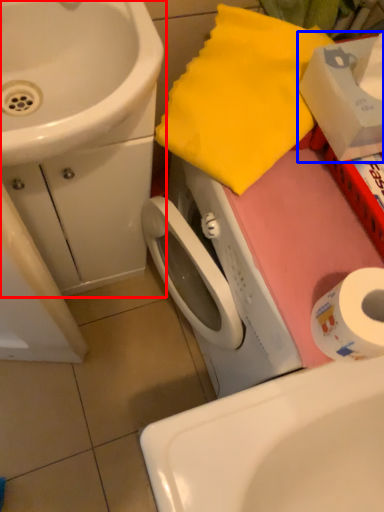
Question: Which object is closer to the camera taking this photo, sink (highlighted by a red box) or box (highlighted by a blue box)?

Choices:
 (A) sink
 (B) box

Answer: (B)